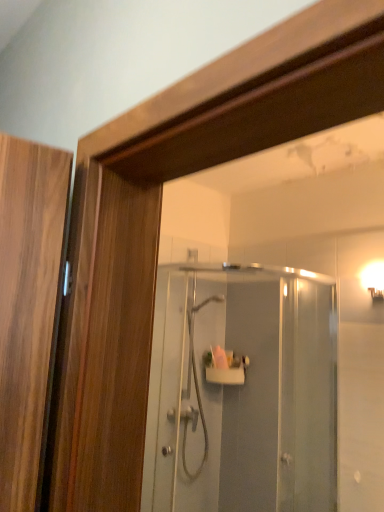
Question: Is clear glass shower door at center taller than white glossy shower at center?

Choices:
 (A) no
 (B) yes

Answer: (B)

Question: Does clear glass shower door at center have a lesser height compared to white glossy shower at center?

Choices:
 (A) no
 (B) yes

Answer: (A)

Question: Considering the relative sizes of clear glass shower door at center and white glossy shower at center in the image provided, is clear glass shower door at center thinner than white glossy shower at center?

Choices:
 (A) yes
 (B) no

Answer: (A)

Question: From the image's perspective, would you say clear glass shower door at center is positioned over white glossy shower at center?

Choices:
 (A) yes
 (B) no

Answer: (A)

Question: Does clear glass shower door at center appear on the left side of white glossy shower at center?

Choices:
 (A) no
 (B) yes

Answer: (A)

Question: Is clear glass shower door at center next to white glossy shower at center?

Choices:
 (A) no
 (B) yes

Answer: (A)

Question: Is white glossy wall sconce at upper right behind clear glass shower door at center?

Choices:
 (A) yes
 (B) no

Answer: (A)

Question: Is white glossy wall sconce at upper right completely or partially outside of clear glass shower door at center?

Choices:
 (A) no
 (B) yes

Answer: (B)

Question: From a real-world perspective, is white glossy wall sconce at upper right physically above clear glass shower door at center?

Choices:
 (A) yes
 (B) no

Answer: (A)

Question: Can you confirm if white glossy wall sconce at upper right is smaller than clear glass shower door at center?

Choices:
 (A) yes
 (B) no

Answer: (A)

Question: Is white glossy wall sconce at upper right turned away from clear glass shower door at center?

Choices:
 (A) no
 (B) yes

Answer: (A)

Question: Is white glossy wall sconce at upper right far away from clear glass shower door at center?

Choices:
 (A) yes
 (B) no

Answer: (B)

Question: Is clear glass shower door at center to the right of white glossy wall sconce at upper right from the viewer's perspective?

Choices:
 (A) yes
 (B) no

Answer: (B)